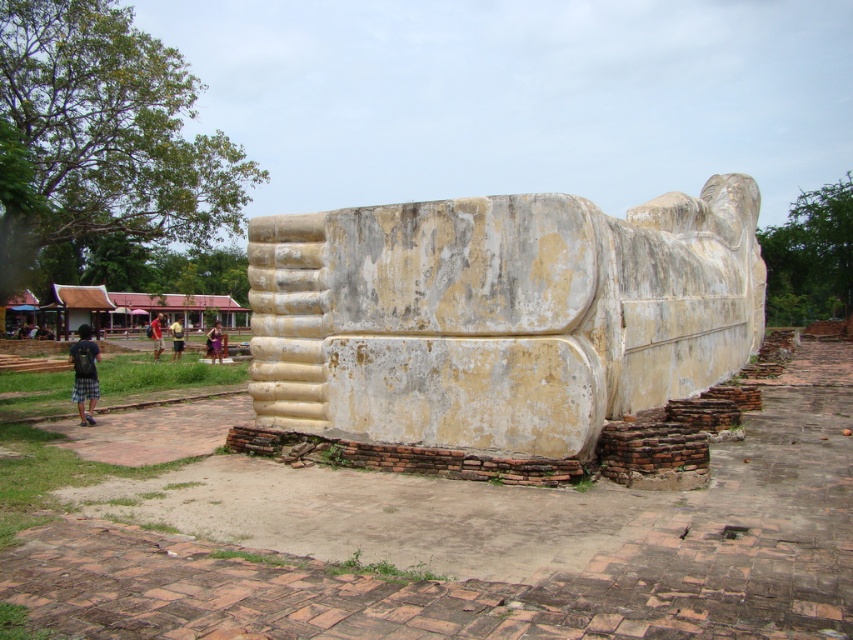
You are a visitor at the historical site and want to sit on the light brown wooden bench at center. From the white stone statue at center, which direction should you walk to reach the bench?

The white stone statue at center is to the right of the light brown wooden bench at center, so you should walk to the left to reach the bench from the statue.

You are a visitor standing in front of the white stone statue at center and the light brown wooden bench at center. Which object is taller?

The white stone statue at center is taller than the light brown wooden bench at center.

You are a tour guide explaining the statue to visitors. You mention the white stone statue at center and the light brown fabric shorts at center. Which object is wider?

The white stone statue at center is wider than the light brown fabric shorts at center.